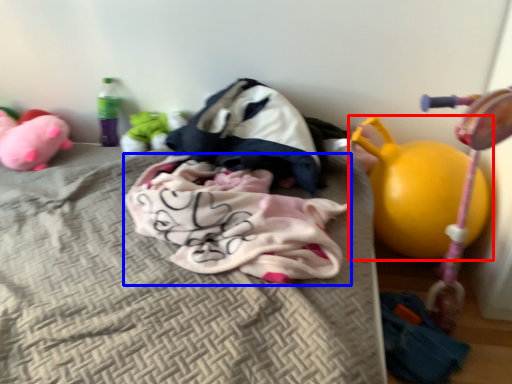
Question: Among these objects, which one is nearest to the camera, toy (highlighted by a red box) or baby clothe (highlighted by a blue box)?

Choices:
 (A) toy
 (B) baby clothe

Answer: (B)